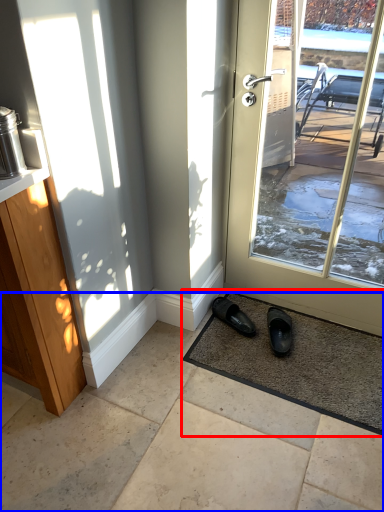
Question: Among these objects, which one is farthest to the camera, mat (highlighted by a red box) or concrete (highlighted by a blue box)?

Choices:
 (A) mat
 (B) concrete

Answer: (A)